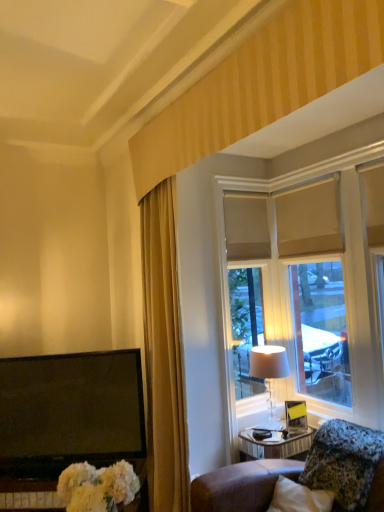
Question: Is point (220, 281) closer or farther from the camera than point (244, 466)?

Choices:
 (A) farther
 (B) closer

Answer: (A)

Question: Is beige fabric window at upper right in front of or behind granite-like stone pillow at lower right in the image?

Choices:
 (A) behind
 (B) front

Answer: (A)

Question: Which object is the farthest from the white fluffy bouquet at lower left?

Choices:
 (A) gold fabric curtain at left
 (B) beige fabric window at upper right
 (C) matte beige lampshade at right
 (D) granite-like stone pillow at lower right

Answer: (B)

Question: Which object is positioned closest to the matte beige lampshade at right?

Choices:
 (A) granite-like stone pillow at lower right
 (B) white fluffy bouquet at lower left
 (C) gold fabric curtain at left
 (D) beige fabric window at upper right

Answer: (D)